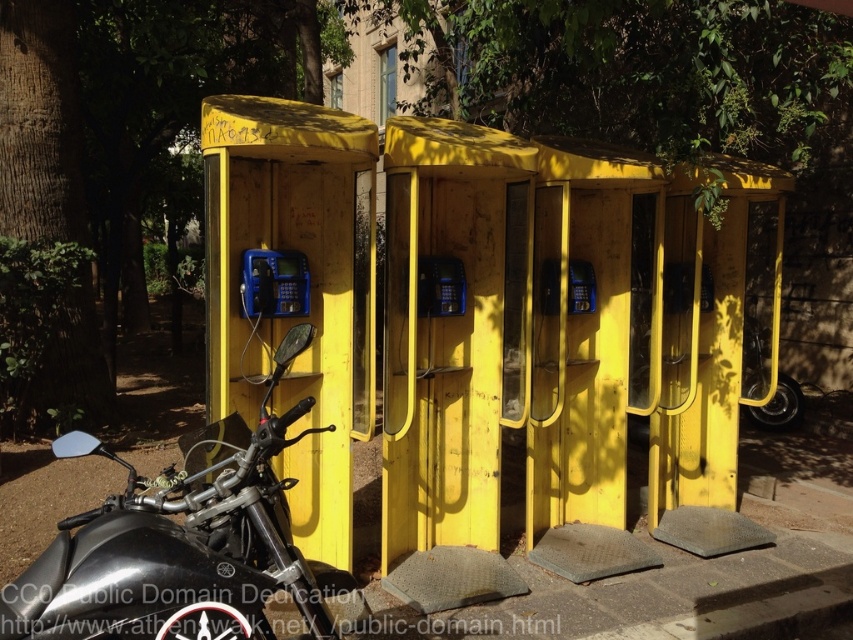
Question: Which point is farther to the camera?

Choices:
 (A) (148, 592)
 (B) (242, 314)

Answer: (B)

Question: Is black metallic motorcycle at left wider than blue plastic payphone at center?

Choices:
 (A) no
 (B) yes

Answer: (B)

Question: Considering the relative positions of black metallic motorcycle at left and blue plastic payphone at center in the image provided, where is black metallic motorcycle at left located with respect to blue plastic payphone at center?

Choices:
 (A) left
 (B) right

Answer: (B)

Question: From the image, what is the correct spatial relationship of black metallic motorcycle at left in relation to blue plastic payphone at center?

Choices:
 (A) below
 (B) above

Answer: (A)

Question: Which point is farther to the camera?

Choices:
 (A) black metallic motorcycle at left
 (B) blue plastic payphone at center

Answer: (B)